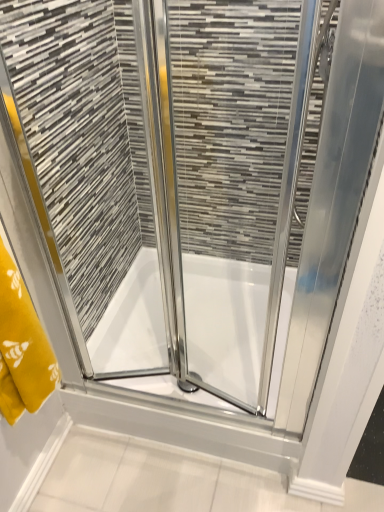
Question: Can you confirm if white glossy bath at center is positioned to the right of yellow fabric towel at left?

Choices:
 (A) no
 (B) yes

Answer: (B)

Question: Is white glossy bath at center located outside yellow fabric towel at left?

Choices:
 (A) yes
 (B) no

Answer: (A)

Question: Is white glossy bath at center in contact with yellow fabric towel at left?

Choices:
 (A) no
 (B) yes

Answer: (A)

Question: Is white glossy bath at center taller than yellow fabric towel at left?

Choices:
 (A) yes
 (B) no

Answer: (B)

Question: Can you confirm if white glossy bath at center is thinner than yellow fabric towel at left?

Choices:
 (A) yes
 (B) no

Answer: (B)

Question: Is the position of white glossy bath at center more distant than that of yellow fabric towel at left?

Choices:
 (A) yes
 (B) no

Answer: (A)

Question: Does yellow fabric towel at left appear on the right side of white glossy bath at center?

Choices:
 (A) no
 (B) yes

Answer: (A)

Question: Is yellow fabric towel at left to the left of white glossy bath at center from the viewer's perspective?

Choices:
 (A) no
 (B) yes

Answer: (B)

Question: From the image's perspective, is yellow fabric towel at left over white glossy bath at center?

Choices:
 (A) yes
 (B) no

Answer: (A)

Question: Considering the relative sizes of yellow fabric towel at left and white glossy bath at center in the image provided, is yellow fabric towel at left wider than white glossy bath at center?

Choices:
 (A) no
 (B) yes

Answer: (A)

Question: Is yellow fabric towel at left next to white glossy bath at center?

Choices:
 (A) yes
 (B) no

Answer: (B)

Question: Is white glossy bath at center located within yellow fabric towel at left?

Choices:
 (A) yes
 (B) no

Answer: (B)

Question: Considering the positions of white glossy bath at center and yellow fabric towel at left in the image, is white glossy bath at center taller or shorter than yellow fabric towel at left?

Choices:
 (A) short
 (B) tall

Answer: (A)